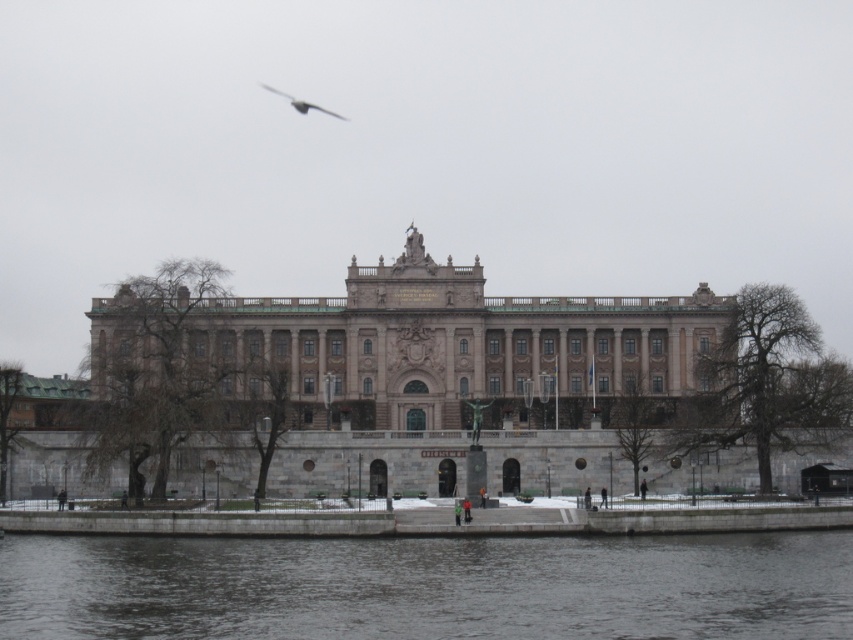
Between point (701, 289) and point (306, 108), which one is positioned in front?

Point (701, 289) is in front.

Between point (467, 353) and point (262, 86), which one is positioned behind?

The point (262, 86) is behind.

What do you see at coordinates (459, 339) in the screenshot? I see `beige stone palace at center` at bounding box center [459, 339].

You are a GUI agent. You are given a task and a screenshot of the screen. Output one action in this format:
    pyautogui.click(x=<x>, y=<y>)
    Task: Click on the beige stone palace at center
    The width and height of the screenshot is (853, 640).
    Given the screenshot: What is the action you would take?
    [x=459, y=339]

Can you confirm if gray concrete river at lower center is taller than beige stone palace at center?

Incorrect, gray concrete river at lower center's height is not larger of beige stone palace at center's.

This screenshot has width=853, height=640. In order to click on gray concrete river at lower center in this screenshot , I will do `click(428, 586)`.

Can you confirm if gray concrete river at lower center is taller than gray feathered bird at upper center?

Yes, gray concrete river at lower center is taller than gray feathered bird at upper center.

Is point (842, 605) farther from camera compared to point (306, 100)?

No, it is in front of (306, 100).

Find the location of a particular element. gray concrete river at lower center is located at coordinates (428, 586).